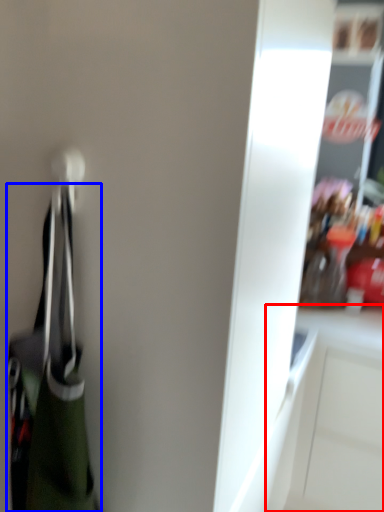
Question: Which of the following is the farthest to the observer, cabinetry (highlighted by a red box) or handbag (highlighted by a blue box)?

Choices:
 (A) cabinetry
 (B) handbag

Answer: (A)